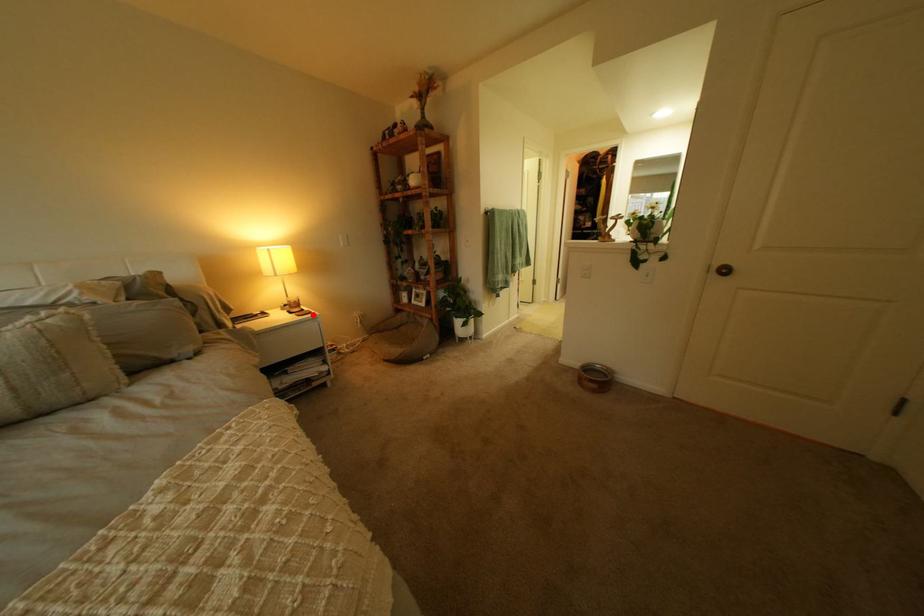
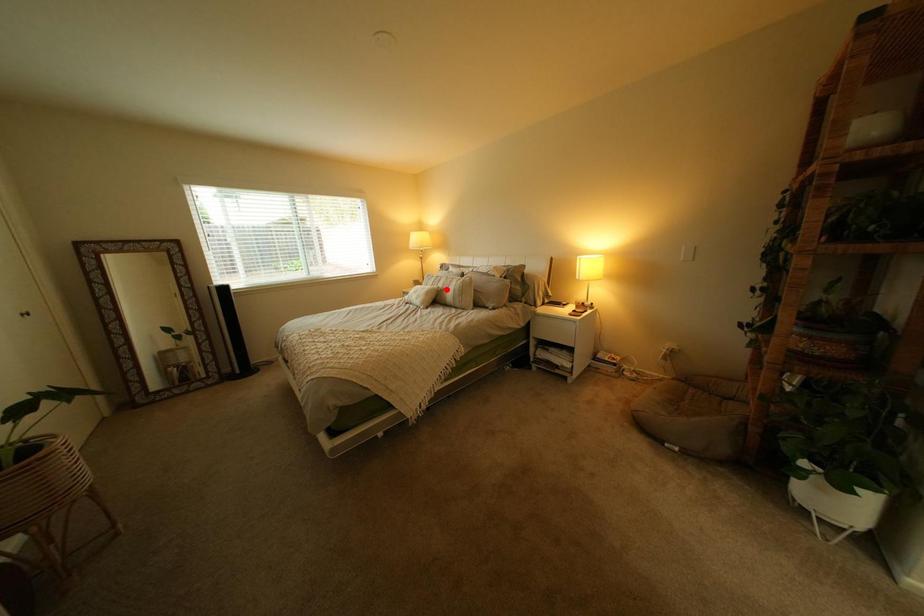
I am providing you with two images of the same scene from different viewpoints. A red point is marked on the first image and another point is marked on the second image. Do the highlighted points in image1 and image2 indicate the same real-world spot?

No